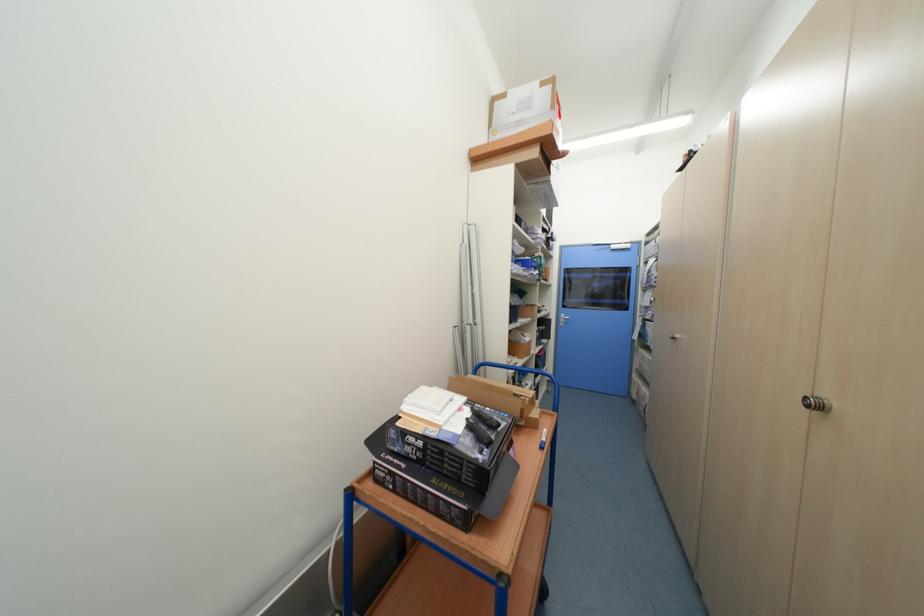
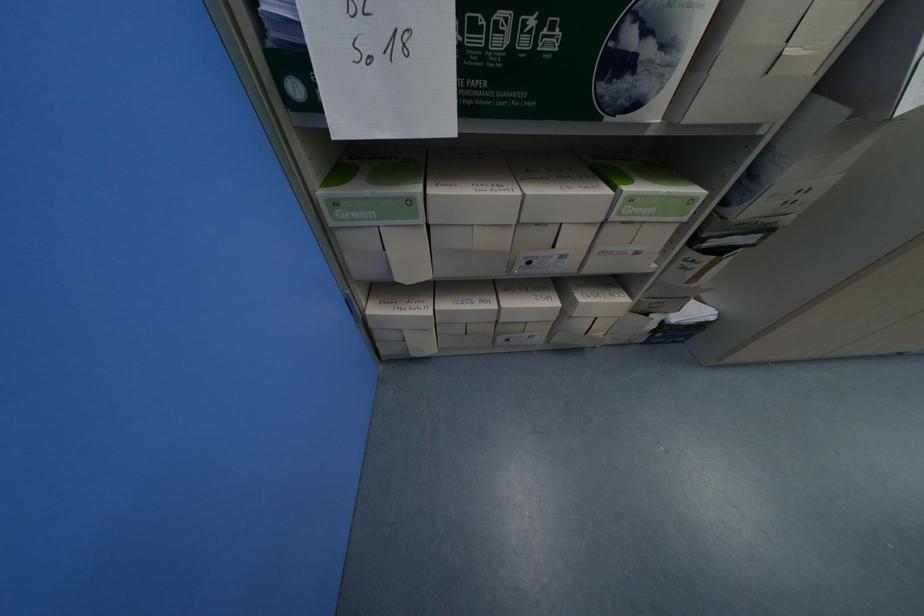
In the second image, find the point that corresponds to point (640, 377) in the first image.

(381, 312)